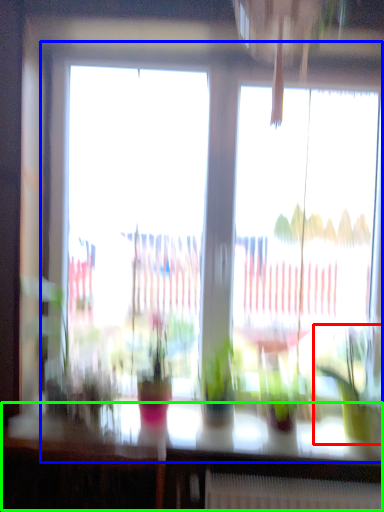
Question: Which is nearer to the houseplant (highlighted by a red box)? window (highlighted by a blue box) or table (highlighted by a green box).

Choices:
 (A) window
 (B) table

Answer: (B)